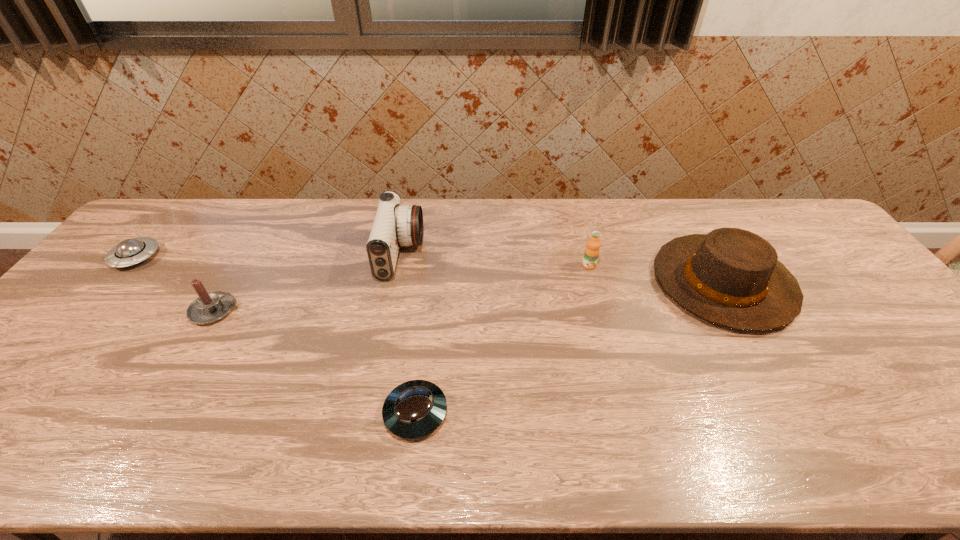
Where is `free spot that satisfies the following two spatial constraints: 1. on the surface of the camcorder; 2. on the front side of the leftmost object`? free spot that satisfies the following two spatial constraints: 1. on the surface of the camcorder; 2. on the front side of the leftmost object is located at coordinates (400, 258).